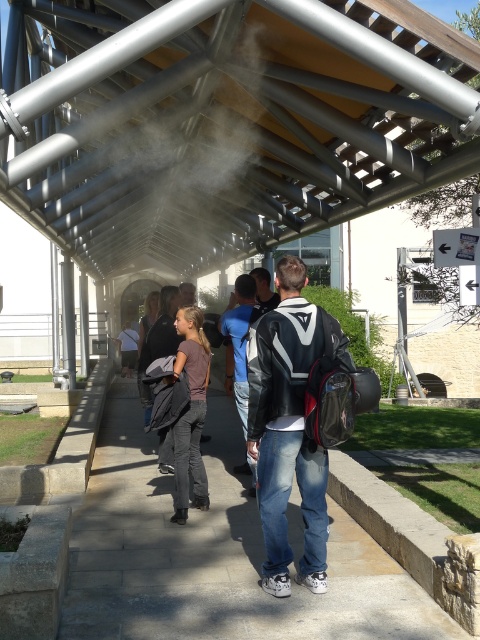
Question: Which point appears closest to the camera in this image?

Choices:
 (A) (317, 580)
 (B) (275, 214)
 (C) (417, 593)

Answer: (A)

Question: Does paved stone sidewalk at center have a lesser width compared to matte black jacket at center?

Choices:
 (A) no
 (B) yes

Answer: (A)

Question: Which point is closer to the camera taking this photo?

Choices:
 (A) (285, 161)
 (B) (274, 396)
 (C) (190, 305)
 (D) (321, 616)

Answer: (D)

Question: Based on their relative distances, which object is farther from the paved stone sidewalk at center?

Choices:
 (A) dark brown leather jacket at center
 (B) white fog at center

Answer: (B)

Question: Does white fog at center appear over matte black jacket at center?

Choices:
 (A) yes
 (B) no

Answer: (A)

Question: Is matte black jacket at center wider than dark brown leather jacket at center?

Choices:
 (A) no
 (B) yes

Answer: (B)